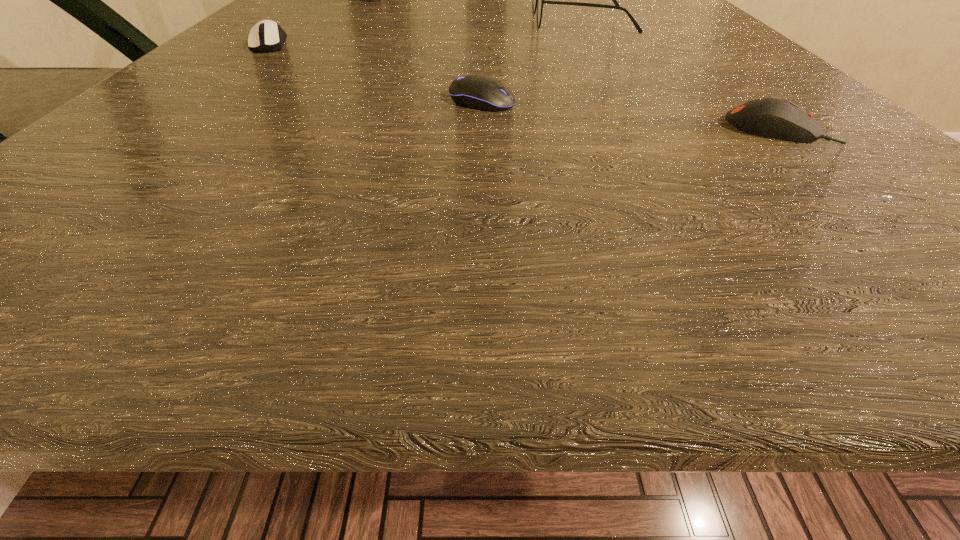
Where is `vacant space at the near edge of the desktop`? This screenshot has width=960, height=540. vacant space at the near edge of the desktop is located at coordinates (187, 278).

This screenshot has height=540, width=960. I want to click on free region at the left edge of the desktop, so click(153, 134).

In the image, there is a desktop. Where is `vacant space at the far left corner`? vacant space at the far left corner is located at coordinates [345, 10].

Find the location of a particular element. free spot at the far right corner of the desktop is located at coordinates (676, 12).

You are a GUI agent. You are given a task and a screenshot of the screen. Output one action in this format:
    pyautogui.click(x=<x>, y=<y>)
    Task: Click on the vacant space at the near right corner
    The image size is (960, 540).
    Given the screenshot: What is the action you would take?
    pyautogui.click(x=828, y=248)

Find the location of a particular element. free space between the farthest computer mouse and the fourth object from left to right is located at coordinates (426, 32).

Image resolution: width=960 pixels, height=540 pixels. I want to click on vacant region between the spectacles and the rightmost object, so click(x=680, y=75).

At what (x,y) coordinates should I click in order to perform the action: click on empty space between the rightmost computer mouse and the leftmost object. Please return your answer as a coordinate pair (x, y). This screenshot has height=540, width=960. Looking at the image, I should click on (524, 87).

At what (x,y) coordinates should I click in order to perform the action: click on vacant region between the second farthest computer mouse and the third nearest object. Please return your answer as a coordinate pair (x, y). The height and width of the screenshot is (540, 960). Looking at the image, I should click on (376, 73).

The width and height of the screenshot is (960, 540). Identify the location of empty space that is in between the leftmost object and the fourth nearest object. (426, 32).